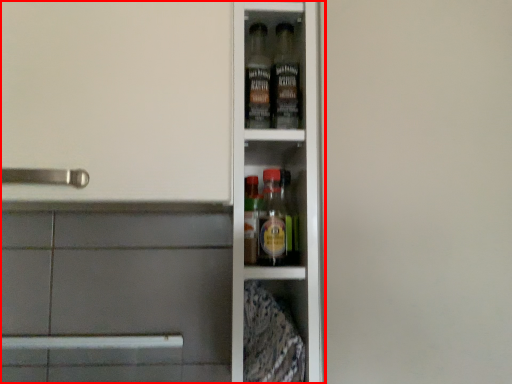
Question: From the image's perspective, what is the correct spatial relationship of shelf (annotated by the red box) in relation to screen door?

Choices:
 (A) below
 (B) above

Answer: (A)